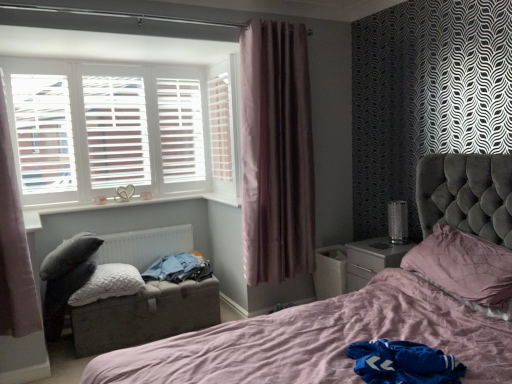
Question: Is black mesh table lamp at right oriented towards white glossy nightstand at lower right?

Choices:
 (A) yes
 (B) no

Answer: (B)

Question: Does black mesh table lamp at right have a smaller size compared to white glossy nightstand at lower right?

Choices:
 (A) no
 (B) yes

Answer: (B)

Question: Considering the relative positions of black mesh table lamp at right and white glossy nightstand at lower right in the image provided, is black mesh table lamp at right behind white glossy nightstand at lower right?

Choices:
 (A) yes
 (B) no

Answer: (A)

Question: Can you confirm if black mesh table lamp at right is positioned to the right of white glossy nightstand at lower right?

Choices:
 (A) no
 (B) yes

Answer: (B)

Question: Is black mesh table lamp at right oriented away from white glossy nightstand at lower right?

Choices:
 (A) yes
 (B) no

Answer: (B)

Question: From a real-world perspective, relative to purple velvet curtain at center, acting as the second curtain starting from the left, is denim jacket at center vertically above or below?

Choices:
 (A) above
 (B) below

Answer: (B)

Question: In terms of height, does denim jacket at center look taller or shorter compared to purple velvet curtain at center, which is counted as the 1th curtain, starting from the right?

Choices:
 (A) short
 (B) tall

Answer: (A)

Question: Is denim jacket at center inside the boundaries of purple velvet curtain at center, which appears as the 2th curtain when viewed from the front, or outside?

Choices:
 (A) inside
 (B) outside

Answer: (B)

Question: Is denim jacket at center wider or thinner than purple velvet curtain at center, which is counted as the 1th curtain, starting from the right?

Choices:
 (A) thin
 (B) wide

Answer: (B)

Question: From the image's perspective, is pink satin pillow at right, which is the second pillow in back-to-front order, positioned above or below black mesh table lamp at right?

Choices:
 (A) below
 (B) above

Answer: (A)

Question: Is pink satin pillow at right, arranged as the second pillow when viewed from the left, inside or outside of black mesh table lamp at right?

Choices:
 (A) inside
 (B) outside

Answer: (B)

Question: From a real-world perspective, is pink satin pillow at right, marked as the 1th pillow in a right-to-left arrangement, above or below black mesh table lamp at right?

Choices:
 (A) below
 (B) above

Answer: (A)

Question: In the image, is pink satin pillow at right, arranged as the second pillow when viewed from the left, on the left side or the right side of black mesh table lamp at right?

Choices:
 (A) right
 (B) left

Answer: (A)

Question: Considering the positions of white wooden shutters at upper left and pink satin pillow at right, which ranks as the first pillow in front-to-back order, in the image, is white wooden shutters at upper left wider or thinner than pink satin pillow at right, which ranks as the first pillow in front-to-back order,?

Choices:
 (A) thin
 (B) wide

Answer: (A)

Question: Looking at the image, does white wooden shutters at upper left seem bigger or smaller compared to pink satin pillow at right, arranged as the second pillow when viewed from the left?

Choices:
 (A) big
 (B) small

Answer: (B)